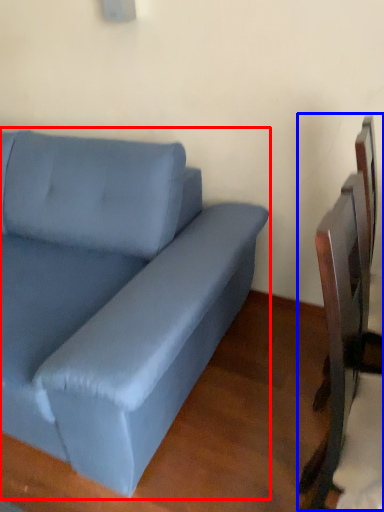
Question: Among these objects, which one is nearest to the camera, studio couch (highlighted by a red box) or swivel chair (highlighted by a blue box)?

Choices:
 (A) studio couch
 (B) swivel chair

Answer: (A)